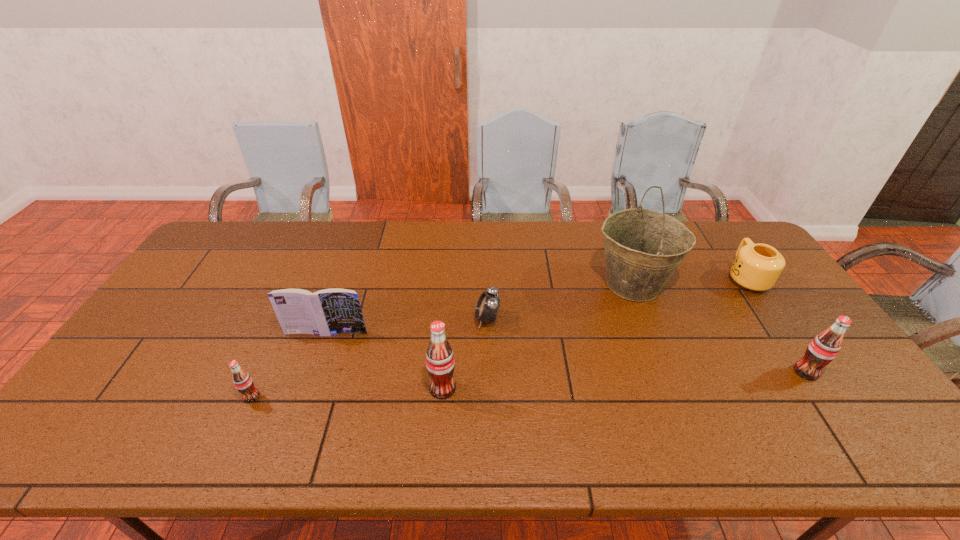
The height and width of the screenshot is (540, 960). What are the coordinates of `vacant position for inserting another pop_(soda) evenly` in the screenshot? It's located at (628, 380).